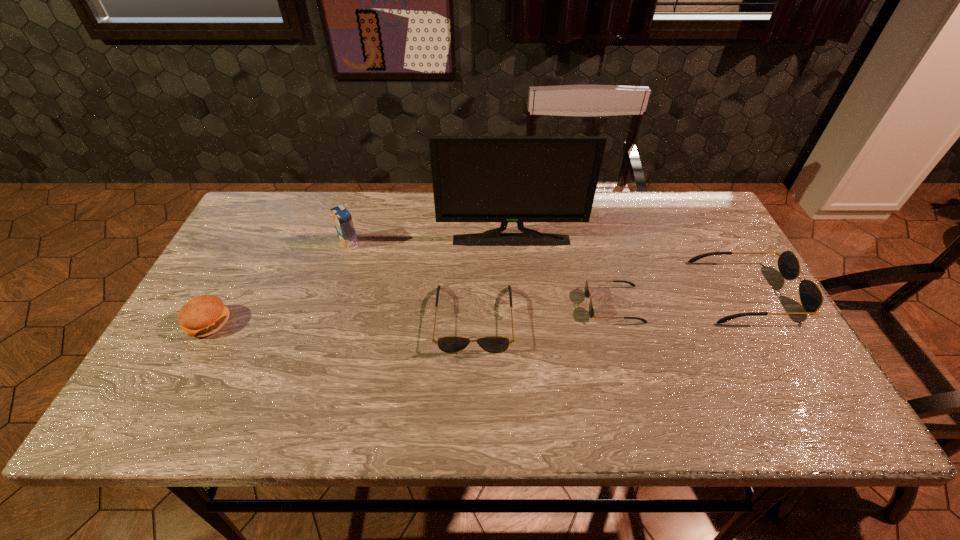
Where is `unoccupied position between the shortest sunglasses and the second object from left to right`? The height and width of the screenshot is (540, 960). unoccupied position between the shortest sunglasses and the second object from left to right is located at coordinates (482, 274).

This screenshot has width=960, height=540. Identify the location of free space between the second sunglasses from left to right and the leftmost sunglasses. (544, 312).

At what (x,y) coordinates should I click in order to perform the action: click on free space between the leftmost sunglasses and the fifth shortest object. Please return your answer as a coordinate pair (x, y). Image resolution: width=960 pixels, height=540 pixels. Looking at the image, I should click on [412, 281].

Locate an element on the screen. free space between the second tallest object and the tallest object is located at coordinates (430, 241).

Where is `object that ranks as the fourth closest to the leftmost object`? The width and height of the screenshot is (960, 540). object that ranks as the fourth closest to the leftmost object is located at coordinates (587, 293).

Locate an element on the screen. This screenshot has height=540, width=960. object that ranks as the closest to the hamburger is located at coordinates (342, 218).

At what (x,y) coordinates should I click in order to perform the action: click on sunglasses that can be found as the closest to the shortest sunglasses. Please return your answer as a coordinate pair (x, y). This screenshot has height=540, width=960. Looking at the image, I should click on (811, 297).

Choose which sunglasses is the nearest neighbor to the hamburger. Please provide its 2D coordinates. Your answer should be formatted as a tuple, i.e. [(x, y)], where the tuple contains the x and y coordinates of a point satisfying the conditions above.

[(449, 344)]